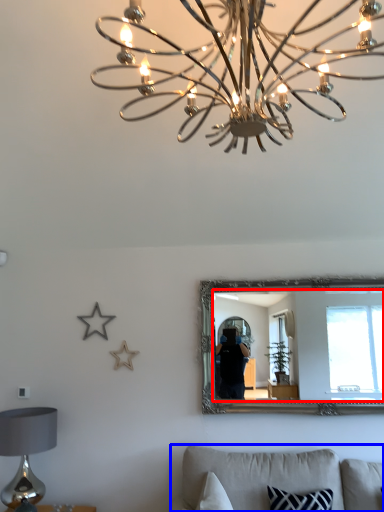
Question: Which point is closer to the camera, mirror (highlighted by a red box) or furniture (highlighted by a blue box)?

Choices:
 (A) mirror
 (B) furniture

Answer: (B)